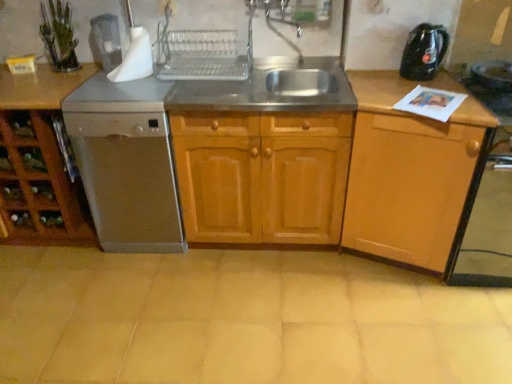
Identify the location of free space to the left of black plastic kettle at upper right. The width and height of the screenshot is (512, 384). (378, 77).